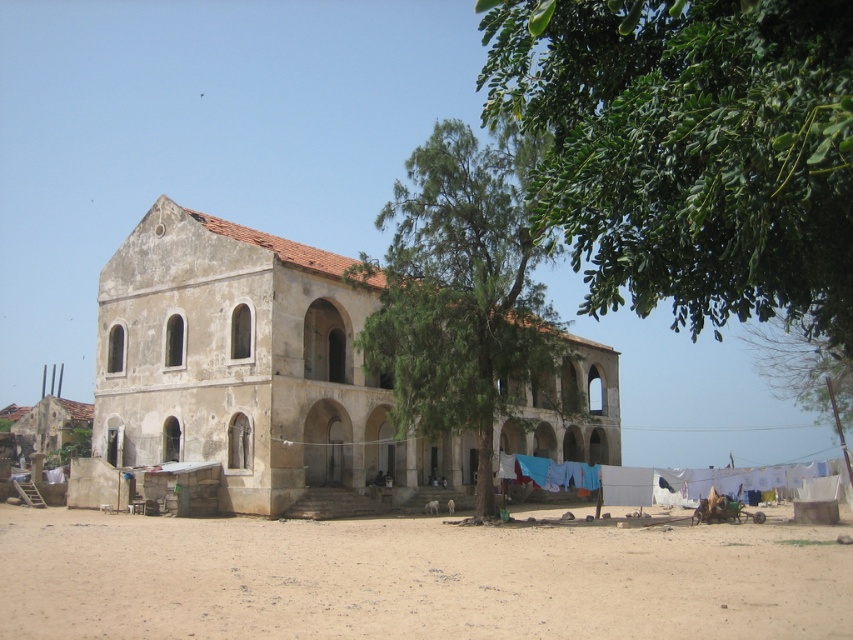
Question: Is green leafy tree at upper right positioned at the back of brown sandy dirt field at lower center?

Choices:
 (A) yes
 (B) no

Answer: (B)

Question: Where is green leafy tree at upper right located in relation to brown sandy dirt field at lower center in the image?

Choices:
 (A) below
 (B) above

Answer: (B)

Question: Which of these objects is positioned closest to the beige plaster church at center?

Choices:
 (A) blue fabric at lower right
 (B) green leafy tree at center
 (C) brown sandy dirt field at lower center

Answer: (B)

Question: Which point appears farthest from the camera in this image?

Choices:
 (A) (625, 497)
 (B) (540, 365)
 (C) (379, 436)
 (D) (155, 572)

Answer: (A)

Question: Which object is closer to the camera taking this photo?

Choices:
 (A) green leafy tree at upper right
 (B) brown sandy dirt field at lower center
 (C) blue fabric at lower right
 (D) beige plaster church at center

Answer: (A)

Question: Is green leafy tree at upper right positioned behind blue fabric at lower right?

Choices:
 (A) yes
 (B) no

Answer: (B)